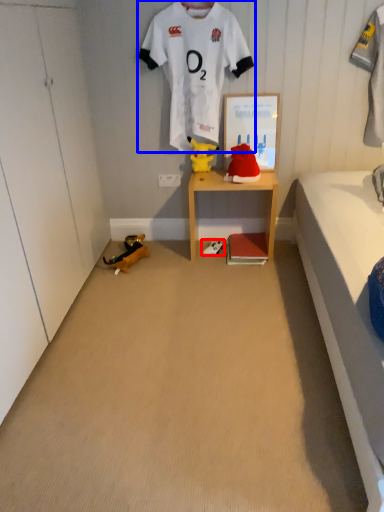
Question: Which of the following is the farthest to the observer, footwear (highlighted by a red box) or sports uniform (highlighted by a blue box)?

Choices:
 (A) footwear
 (B) sports uniform

Answer: (A)